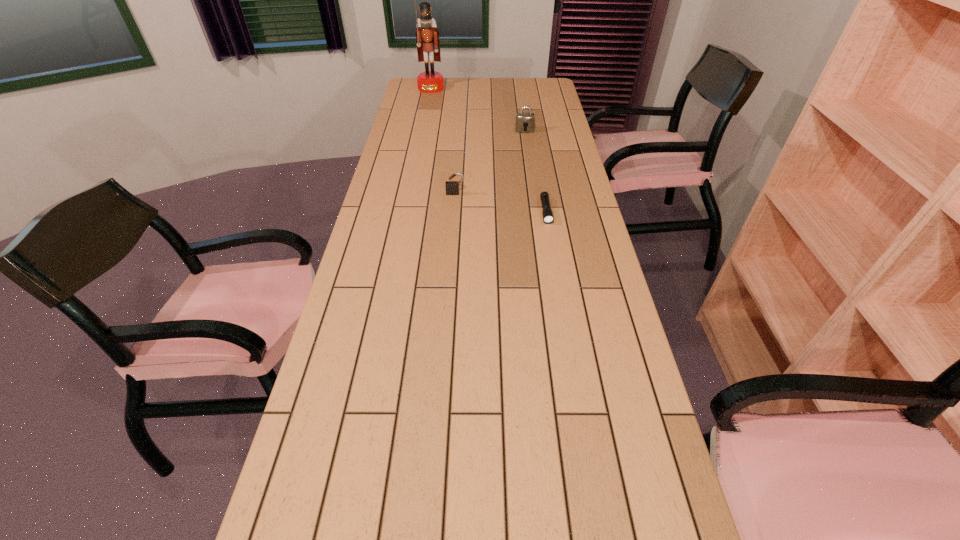
The width and height of the screenshot is (960, 540). Identify the location of blank space located 0.110m with the keyhole on the front of the second nearest object. (454, 214).

Locate an element on the screen. free location located 0.290m at the lens end of the nearest object is located at coordinates (560, 290).

You are a GUI agent. You are given a task and a screenshot of the screen. Output one action in this format:
    pyautogui.click(x=<x>, y=<y>)
    Task: Click on the object that is at the far edge
    The image size is (960, 540).
    Given the screenshot: What is the action you would take?
    pyautogui.click(x=427, y=35)

Find the location of a particular element. The height and width of the screenshot is (540, 960). object that is positioned at the left edge is located at coordinates (427, 35).

Find the location of `padlock that is at the right edge`. padlock that is at the right edge is located at coordinates (525, 121).

Where is `flashlight present at the right edge`? This screenshot has width=960, height=540. flashlight present at the right edge is located at coordinates (548, 218).

Image resolution: width=960 pixels, height=540 pixels. I want to click on object at the far left corner, so click(427, 35).

You are a GUI agent. You are given a task and a screenshot of the screen. Output one action in this format:
    pyautogui.click(x=<x>, y=<y>)
    Task: Click on the vacant space at the far edge
    
    Given the screenshot: What is the action you would take?
    pyautogui.click(x=497, y=78)

The image size is (960, 540). Identify the location of vacant space at the left edge of the desktop. (382, 186).

In order to click on free space at the right edge of the desktop in this screenshot , I will do `click(630, 350)`.